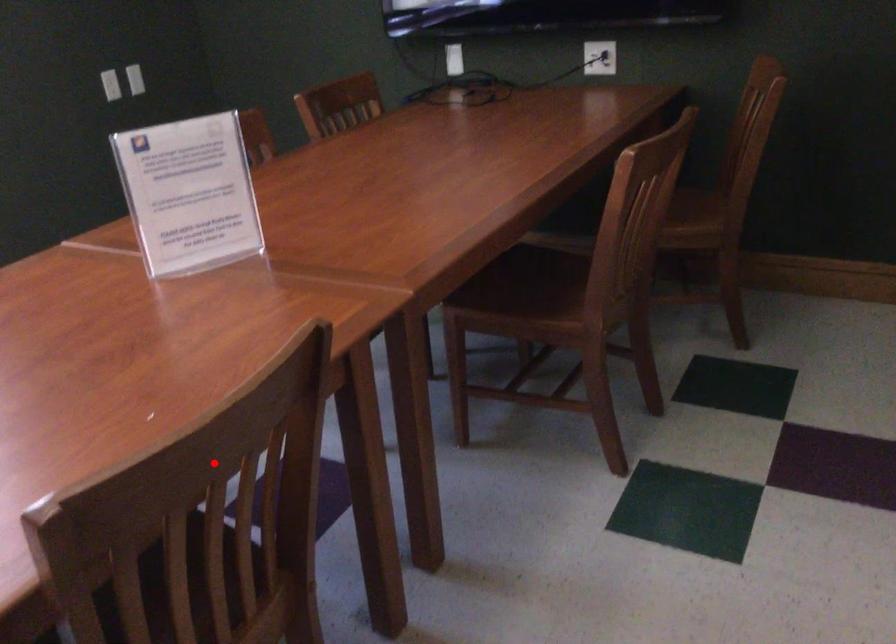
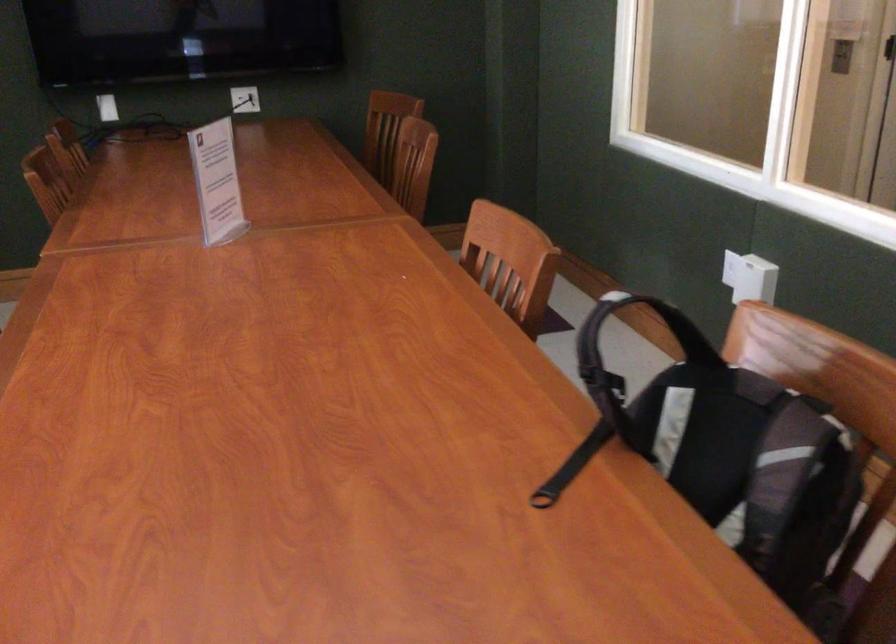
Locate, in the second image, the point that corresponds to the highlighted location in the first image.

(510, 261)